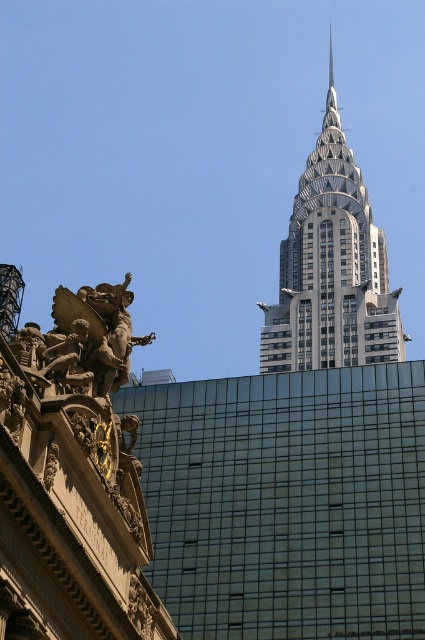
Question: Which object is closer to the camera taking this photo?

Choices:
 (A) silver metallic chrysler building at upper center
 (B) bronze statue at left

Answer: (B)

Question: Is silver metallic chrysler building at upper center below bronze statue at left?

Choices:
 (A) yes
 (B) no

Answer: (B)

Question: Can you confirm if silver metallic chrysler building at upper center is positioned to the right of bronze statue at left?

Choices:
 (A) no
 (B) yes

Answer: (B)

Question: Which point is farther to the camera?

Choices:
 (A) (121, 365)
 (B) (323, 179)

Answer: (B)

Question: Does silver metallic chrysler building at upper center have a greater width compared to bronze statue at left?

Choices:
 (A) yes
 (B) no

Answer: (A)